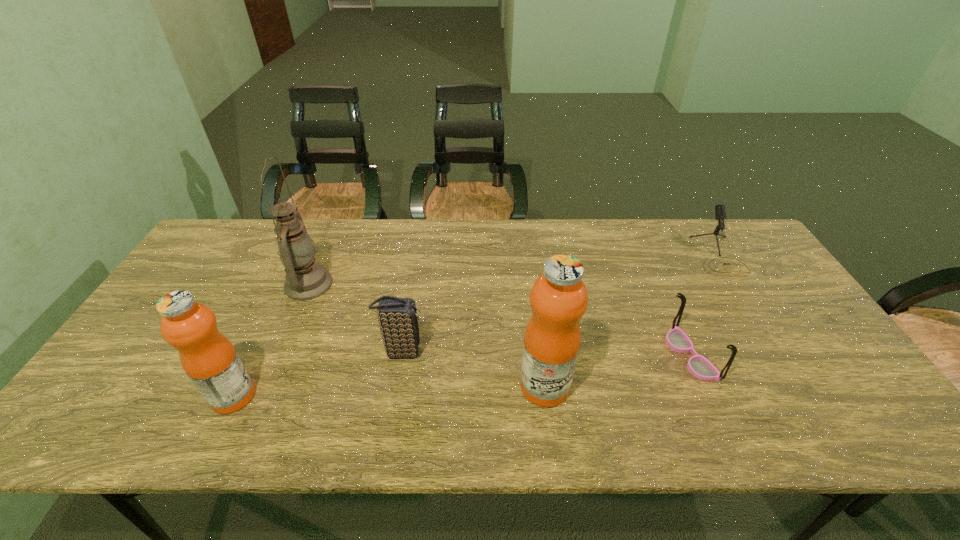
Where is `the shorter fruit juice`? The width and height of the screenshot is (960, 540). the shorter fruit juice is located at coordinates coord(209,359).

This screenshot has height=540, width=960. Find the location of `the left fruit juice`. the left fruit juice is located at coordinates (209, 359).

At what (x,y) coordinates should I click in order to perform the action: click on the third object from right to left. Please return your answer as a coordinate pair (x, y). Image resolution: width=960 pixels, height=540 pixels. Looking at the image, I should click on (559, 298).

Where is `the taller fruit juice`? The image size is (960, 540). the taller fruit juice is located at coordinates (559, 298).

Identify the location of the rightmost object. click(720, 213).

At what (x,y) coordinates should I click in order to perform the action: click on oil lamp. Please return your answer as a coordinate pair (x, y). Looking at the image, I should click on (306, 279).

I want to click on the third object from left to right, so click(x=397, y=317).

Find the location of a particular element. The height and width of the screenshot is (540, 960). clutch bag is located at coordinates (397, 317).

Where is `spectacles`? This screenshot has height=540, width=960. spectacles is located at coordinates (700, 367).

Where is `free space located 0.280m on the right of the left fruit juice`? This screenshot has width=960, height=540. free space located 0.280m on the right of the left fruit juice is located at coordinates (374, 396).